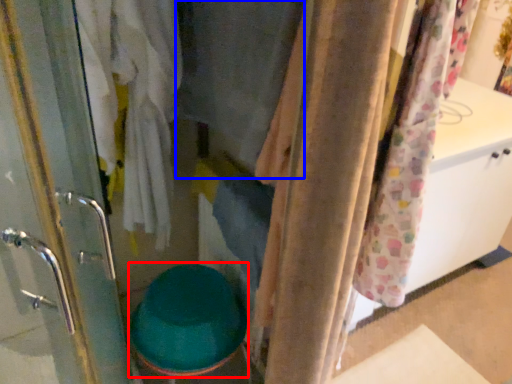
Question: Among these objects, which one is farthest to the camera, toilet bowl (highlighted by a red box) or clothing (highlighted by a blue box)?

Choices:
 (A) toilet bowl
 (B) clothing

Answer: (A)